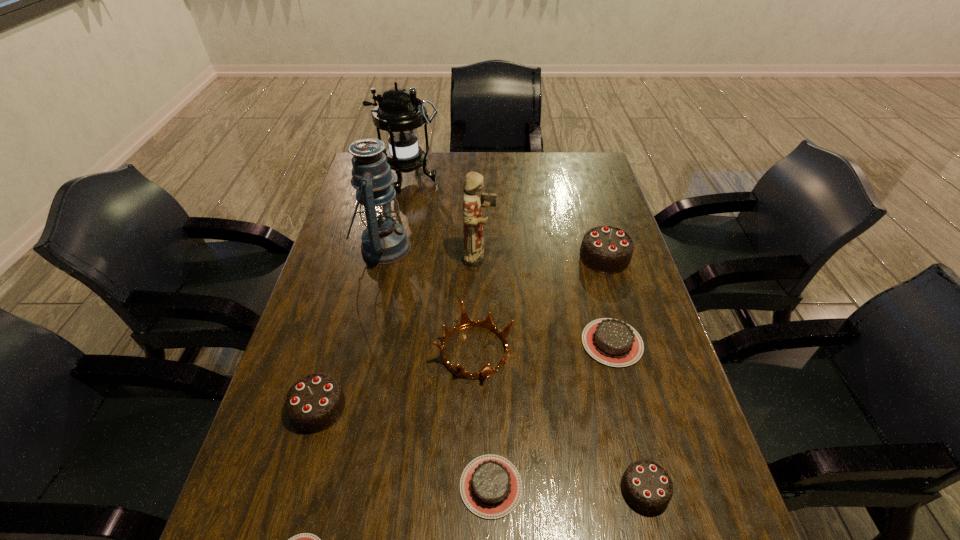
Where is `the third tallest chocolate cake`? This screenshot has width=960, height=540. the third tallest chocolate cake is located at coordinates (646, 485).

This screenshot has height=540, width=960. What are the coordinates of `the rightmost brown chocolate cake` in the screenshot? It's located at (612, 342).

Identify the location of the farthest brown chocolate cake. (612, 342).

What are the coordinates of `the second farthest brown chocolate cake` in the screenshot? It's located at (490, 486).

Where is `the fourth chocolate cake from right to left`? This screenshot has height=540, width=960. the fourth chocolate cake from right to left is located at coordinates (490, 486).

Find the location of `free space located on the front of the black lantern`. free space located on the front of the black lantern is located at coordinates (392, 261).

Find the location of a particular element. blank area located on the front-facing side of the nearer lantern is located at coordinates click(x=479, y=247).

You are a GUI agent. You are given a task and a screenshot of the screen. Output one action in this format:
    pyautogui.click(x=<x>, y=<y>)
    Task: Click on the vacant space located 0.360m on the front-facing side of the figurine
    The image size is (960, 540).
    Given the screenshot: What is the action you would take?
    pyautogui.click(x=616, y=257)

What are the coordinates of `free spot located 0.220m on the front of the farthest chocolate chocolate cake` in the screenshot? It's located at (628, 336).

Where is `free spot located 0.400m on the right of the leftmost chocolate chocolate cake`? This screenshot has width=960, height=540. free spot located 0.400m on the right of the leftmost chocolate chocolate cake is located at coordinates (527, 408).